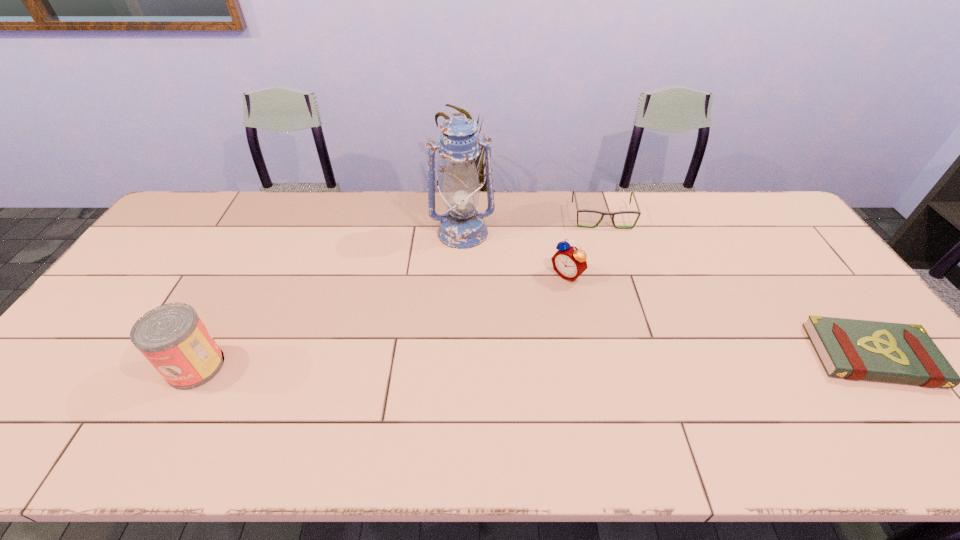
I want to click on vacant space located 0.170m on the back of the leftmost object, so click(x=233, y=297).

Identify the location of free space located on the back of the shortest object. (807, 271).

The width and height of the screenshot is (960, 540). I want to click on vacant space situated 0.250m on the lens of the spectacles, so click(617, 282).

The image size is (960, 540). What are the coordinates of `vacant area situated 0.120m on the lens of the spectacles` in the screenshot? It's located at (611, 253).

At what (x,y) coordinates should I click in order to perform the action: click on vacant area situated 0.380m on the lens of the spectacles. Please return your answer as a coordinate pair (x, y). Looking at the image, I should click on (625, 316).

Where is `free space located on the front-facing side of the third nearest object`? Image resolution: width=960 pixels, height=540 pixels. free space located on the front-facing side of the third nearest object is located at coordinates (538, 301).

The image size is (960, 540). Find the location of `free space located 0.220m on the front-facing side of the third nearest object`. free space located 0.220m on the front-facing side of the third nearest object is located at coordinates (509, 327).

The image size is (960, 540). I want to click on free space located on the front-facing side of the third nearest object, so (x=493, y=340).

The width and height of the screenshot is (960, 540). What are the coordinates of `vacant space located 0.260m on the front-facing side of the tallest object` in the screenshot? It's located at (477, 310).

You are a GUI agent. You are given a task and a screenshot of the screen. Output one action in this format:
    pyautogui.click(x=<x>, y=<y>)
    Task: Click on the vacant position located 0.150m on the front-facing side of the tallest object
    This screenshot has width=960, height=540.
    Given the screenshot: What is the action you would take?
    pyautogui.click(x=472, y=282)